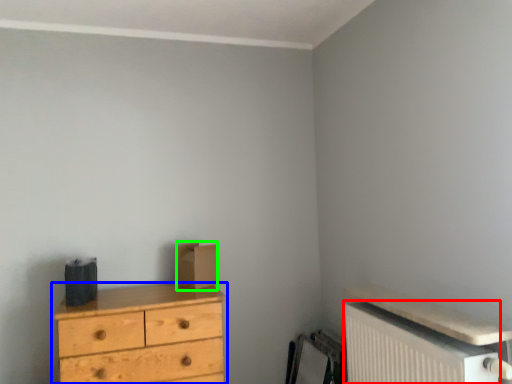
Question: Estimate the real-world distances between objects in this image. Which object is closer to radiator (highlighted by a red box), chest of drawers (highlighted by a blue box) or cardboard box (highlighted by a green box)?

Choices:
 (A) chest of drawers
 (B) cardboard box

Answer: (A)